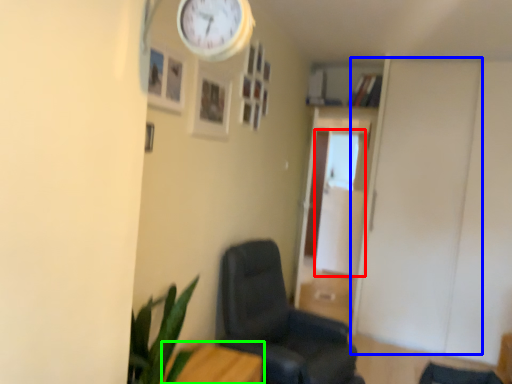
Question: Which object is the farthest from glass door (highlighted by a red box)? Choose among these: door (highlighted by a blue box) or furniture (highlighted by a green box).

Choices:
 (A) door
 (B) furniture

Answer: (B)